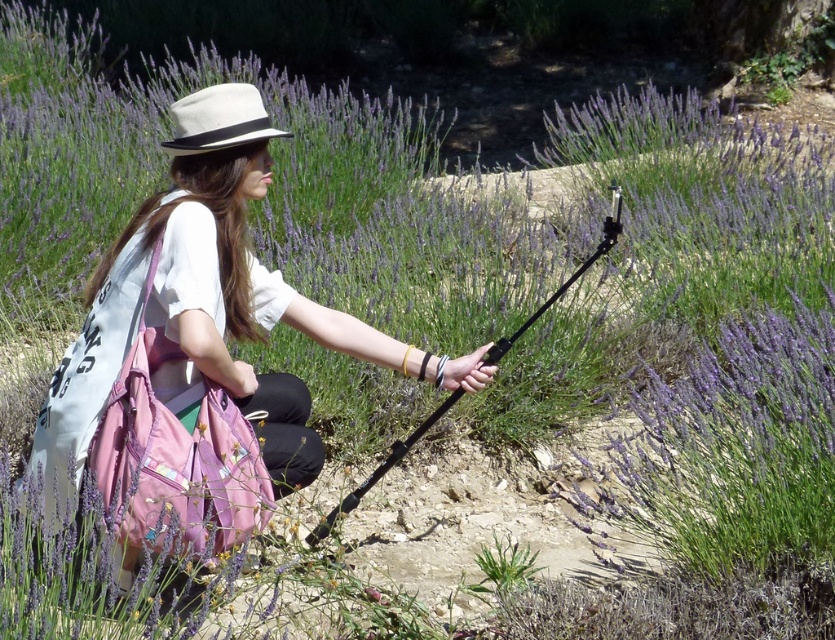
You are a photographer trying to decide which item to place in your camera bag. You have the pink fabric bag at center and the black matte tripod at center. Which item can you fit into your camera bag if it has a capacity for items smaller than the other?

The black matte tripod at center is smaller than the pink fabric bag at center, so it can fit into the camera bag.

Consider the image. You are a photographer trying to capture the lavender field in the background. You need to position your camera so that the pink fabric bag at center is exactly at the center of the frame. What coordinates should you aim for?

The pink fabric bag at center is located at coordinates point [209,326], so you should aim your camera at those coordinates to center it in the frame.